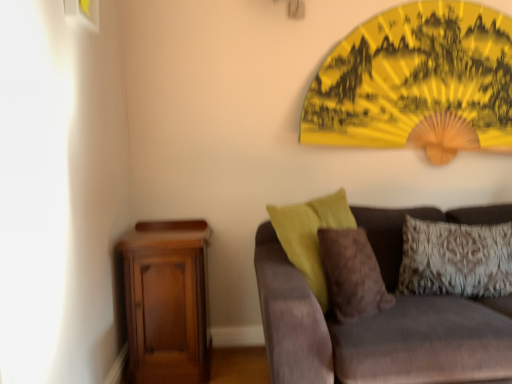
This screenshot has width=512, height=384. I want to click on mahogany wood nightstand at lower left, so click(163, 301).

What do you see at coordinates (83, 13) in the screenshot?
I see `matte white picture frame at upper left` at bounding box center [83, 13].

What do you see at coordinates (352, 274) in the screenshot? Image resolution: width=512 pixels, height=384 pixels. I see `brown fuzzy pillow at center, which appears as the 1th pillow when viewed from the left` at bounding box center [352, 274].

Measure the distance between patterned fabric pillow at right, marked as the 1th pillow in a right-to-left arrangement, and camera.

The depth of patterned fabric pillow at right, marked as the 1th pillow in a right-to-left arrangement, is 1.92 meters.

The width and height of the screenshot is (512, 384). I want to click on velvet brown couch at lower right, so click(x=377, y=333).

Is mahogany wood nightstand at lower left spatially inside velvet brown couch at lower right, or outside of it?

mahogany wood nightstand at lower left lies outside velvet brown couch at lower right.

Between mahogany wood nightstand at lower left and velvet brown couch at lower right, which one has smaller width?

Thinner between the two is mahogany wood nightstand at lower left.

This screenshot has height=384, width=512. What are the coordinates of `studio couch above the mahogany wood nightstand at lower left (from the image's perspective)` in the screenshot? It's located at (377, 333).

From the image's perspective, is brown fuzzy pillow at center, which appears as the 1th pillow when viewed from the left, on velvet brown couch at lower right?

Correct, brown fuzzy pillow at center, which appears as the 1th pillow when viewed from the left, appears higher than velvet brown couch at lower right in the image.

Is brown fuzzy pillow at center, the 2th pillow viewed from the right, far from velvet brown couch at lower right?

No, brown fuzzy pillow at center, the 2th pillow viewed from the right, is in close proximity to velvet brown couch at lower right.

Between brown fuzzy pillow at center, which appears as the 1th pillow when viewed from the left, and velvet brown couch at lower right, which one appears on the right side from the viewer's perspective?

Positioned to the right is velvet brown couch at lower right.

From the picture: Does brown fuzzy pillow at center, the 2th pillow viewed from the right, have a lesser width compared to velvet brown couch at lower right?

Indeed, brown fuzzy pillow at center, the 2th pillow viewed from the right, has a lesser width compared to velvet brown couch at lower right.

Is brown fuzzy pillow at center, the 2th pillow viewed from the right, next to matte white picture frame at upper left?

No, brown fuzzy pillow at center, the 2th pillow viewed from the right, is not in contact with matte white picture frame at upper left.

Starting from the matte white picture frame at upper left, which pillow is the 1st one behind? Please provide its 2D coordinates.

[(352, 274)]

Considering the sizes of brown fuzzy pillow at center, which appears as the 1th pillow when viewed from the left, and matte white picture frame at upper left in the image, is brown fuzzy pillow at center, which appears as the 1th pillow when viewed from the left, wider or thinner than matte white picture frame at upper left?

Clearly, brown fuzzy pillow at center, which appears as the 1th pillow when viewed from the left, has more width compared to matte white picture frame at upper left.

Which object is further away from the camera taking this photo, matte white picture frame at upper left or velvet brown couch at lower right?

matte white picture frame at upper left is further from the camera.

From a real-world perspective, relative to velvet brown couch at lower right, is matte white picture frame at upper left vertically above or below?

matte white picture frame at upper left is above velvet brown couch at lower right.

From the picture: From the image's perspective, would you say matte white picture frame at upper left is positioned over velvet brown couch at lower right?

Yes, from the image's perspective, matte white picture frame at upper left is above velvet brown couch at lower right.

Does point (83, 4) lie in front of point (344, 363)?

That is False.

How many degrees apart are the facing directions of matte white picture frame at upper left and mahogany wood nightstand at lower left?

89.7 degrees.

Is matte white picture frame at upper left wider or thinner than mahogany wood nightstand at lower left?

Clearly, matte white picture frame at upper left has less width compared to mahogany wood nightstand at lower left.

Which of these two, matte white picture frame at upper left or mahogany wood nightstand at lower left, is bigger?

With larger size is mahogany wood nightstand at lower left.

Who is bigger, brown fuzzy pillow at center, the 2th pillow viewed from the right, or mahogany wood nightstand at lower left?

Bigger between the two is mahogany wood nightstand at lower left.

Who is taller, brown fuzzy pillow at center, which appears as the 1th pillow when viewed from the left, or mahogany wood nightstand at lower left?

mahogany wood nightstand at lower left is taller.

Looking at their sizes, would you say brown fuzzy pillow at center, the 2th pillow viewed from the right, is wider or thinner than mahogany wood nightstand at lower left?

Clearly, brown fuzzy pillow at center, the 2th pillow viewed from the right, has less width compared to mahogany wood nightstand at lower left.

The height and width of the screenshot is (384, 512). In the image, there is a patterned fabric pillow at right, positioned as the 2th pillow in left-to-right order. Identify the location of studio couch below it (from a real-world perspective). (377, 333).

Is velvet brown couch at lower right wider than patterned fabric pillow at right, marked as the 1th pillow in a right-to-left arrangement?

Yes.

Considering the relative sizes of velvet brown couch at lower right and patterned fabric pillow at right, marked as the 1th pillow in a right-to-left arrangement, in the image provided, is velvet brown couch at lower right shorter than patterned fabric pillow at right, marked as the 1th pillow in a right-to-left arrangement,?

Incorrect, the height of velvet brown couch at lower right does not fall short of that of patterned fabric pillow at right, marked as the 1th pillow in a right-to-left arrangement.

Locate an element on the screen. Image resolution: width=512 pixels, height=384 pixels. studio couch lying on the right of mahogany wood nightstand at lower left is located at coordinates (377, 333).

This screenshot has height=384, width=512. What are the coordinates of `studio couch that appears below the brown fuzzy pillow at center, the 2th pillow viewed from the right (from the image's perspective)` in the screenshot? It's located at (377, 333).

From the image, which object appears to be nearer to mahogany wood nightstand at lower left, brown fuzzy pillow at center, which appears as the 1th pillow when viewed from the left, or patterned fabric pillow at right, marked as the 1th pillow in a right-to-left arrangement?

brown fuzzy pillow at center, which appears as the 1th pillow when viewed from the left.

Estimate the real-world distances between objects in this image. Which object is further from brown fuzzy pillow at center, the 2th pillow viewed from the right, patterned fabric pillow at right, marked as the 1th pillow in a right-to-left arrangement, or mahogany wood nightstand at lower left?

Based on the image, mahogany wood nightstand at lower left appears to be further to brown fuzzy pillow at center, the 2th pillow viewed from the right.

When comparing their distances from patterned fabric pillow at right, marked as the 1th pillow in a right-to-left arrangement, does brown fuzzy pillow at center, which appears as the 1th pillow when viewed from the left, or mahogany wood nightstand at lower left seem further?

The object further to patterned fabric pillow at right, marked as the 1th pillow in a right-to-left arrangement, is mahogany wood nightstand at lower left.

Looking at the image, which one is located closer to brown fuzzy pillow at center, which appears as the 1th pillow when viewed from the left, patterned fabric pillow at right, marked as the 1th pillow in a right-to-left arrangement, or matte white picture frame at upper left?

patterned fabric pillow at right, marked as the 1th pillow in a right-to-left arrangement.

Which object lies further to the anchor point patterned fabric pillow at right, marked as the 1th pillow in a right-to-left arrangement, matte white picture frame at upper left or mahogany wood nightstand at lower left?

The object further to patterned fabric pillow at right, marked as the 1th pillow in a right-to-left arrangement, is matte white picture frame at upper left.

Consider the image. Estimate the real-world distances between objects in this image. Which object is closer to matte white picture frame at upper left, brown fuzzy pillow at center, which appears as the 1th pillow when viewed from the left, or velvet brown couch at lower right?

brown fuzzy pillow at center, which appears as the 1th pillow when viewed from the left, is positioned closer to the anchor matte white picture frame at upper left.

When comparing their distances from matte white picture frame at upper left, does patterned fabric pillow at right, marked as the 1th pillow in a right-to-left arrangement, or mahogany wood nightstand at lower left seem further?

patterned fabric pillow at right, marked as the 1th pillow in a right-to-left arrangement, is further to matte white picture frame at upper left.

Estimate the real-world distances between objects in this image. Which object is closer to mahogany wood nightstand at lower left, patterned fabric pillow at right, marked as the 1th pillow in a right-to-left arrangement, or brown fuzzy pillow at center, the 2th pillow viewed from the right?

brown fuzzy pillow at center, the 2th pillow viewed from the right, is positioned closer to the anchor mahogany wood nightstand at lower left.

Find the location of `studio couch located between mahogany wood nightstand at lower left and patterned fabric pillow at right, marked as the 1th pillow in a right-to-left arrangement, in the left-right direction`. studio couch located between mahogany wood nightstand at lower left and patterned fabric pillow at right, marked as the 1th pillow in a right-to-left arrangement, in the left-right direction is located at coordinates (377, 333).

The image size is (512, 384). What are the coordinates of `studio couch located between matte white picture frame at upper left and patterned fabric pillow at right, marked as the 1th pillow in a right-to-left arrangement, in the left-right direction` in the screenshot? It's located at (377, 333).

Locate an element on the screen. This screenshot has height=384, width=512. pillow situated between mahogany wood nightstand at lower left and velvet brown couch at lower right from left to right is located at coordinates (352, 274).

Locate an element on the screen. This screenshot has height=384, width=512. pillow between mahogany wood nightstand at lower left and patterned fabric pillow at right, positioned as the 2th pillow in left-to-right order, in the horizontal direction is located at coordinates (352, 274).